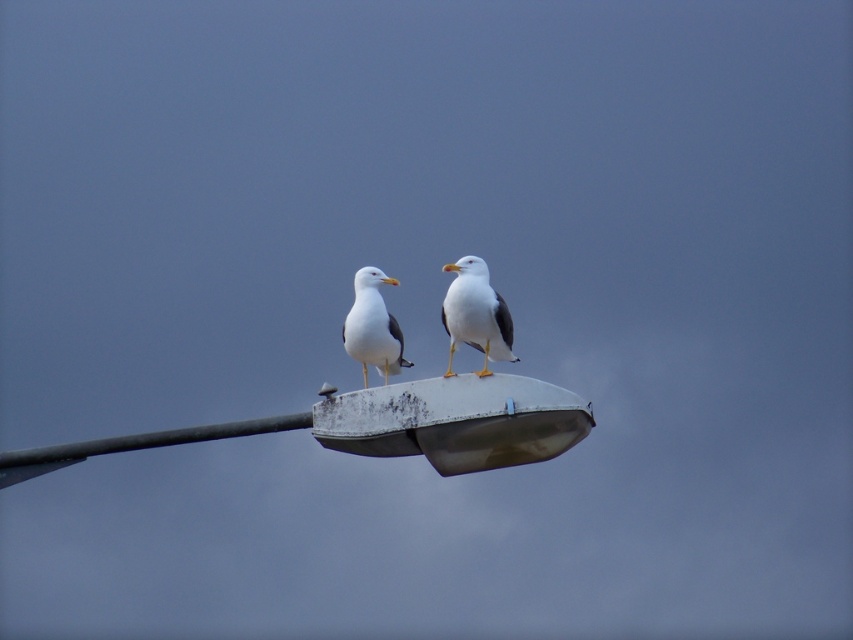
You are a birdwatcher observing two seagulls on a streetlamp. You notice the white matte seagull at upper center and the white matte seagull at center. Which seagull is larger?

The white matte seagull at center is larger than the white matte seagull at upper center.

You are a birdwatcher trying to identify two seagulls perched on a streetlamp. You notice their positions and sizes. Which seagull, the white matte seagull at upper center or the white matte seagull at center, appears to be wider?

The white matte seagull at upper center might be wider than the white matte seagull at center according to the description.

Looking at this image, you are standing in front of the streetlamp with two seagulls perched on it. You notice two points on the streetlamp marked as point A and point B. Point A is at coordinate point (492, 300) and point B is at coordinate point (349, 321). Which point is closer to your viewpoint?

Point A at coordinate point (492, 300) is closer to the camera than point B at coordinate point (349, 321).